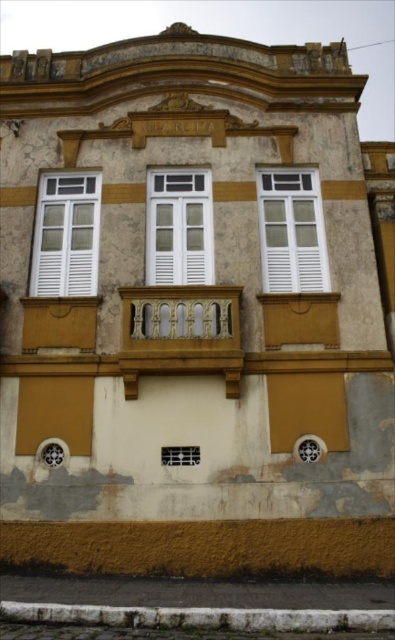
Question: Is white matte window at center to the left of white painted wood window at center from the viewer's perspective?

Choices:
 (A) yes
 (B) no

Answer: (B)

Question: Which object is farther from the camera taking this photo?

Choices:
 (A) white matte window at left
 (B) white matte shutter at lower left
 (C) white matte window at center
 (D) matte white shutter at center

Answer: (A)

Question: Estimate the real-world distances between objects in this image. Which object is closer to the white matte shutter at lower left?

Choices:
 (A) white matte window at left
 (B) white matte window at center
 (C) white painted wood window at center

Answer: (A)

Question: Does white painted wood window at center lie behind white matte shutter at lower left?

Choices:
 (A) no
 (B) yes

Answer: (B)

Question: Which point is farther from the camera taking this photo?

Choices:
 (A) (280, 236)
 (B) (173, 269)
 (C) (314, 381)

Answer: (A)

Question: Can you confirm if white painted wood window at center is bigger than white matte shutter at lower left?

Choices:
 (A) no
 (B) yes

Answer: (B)